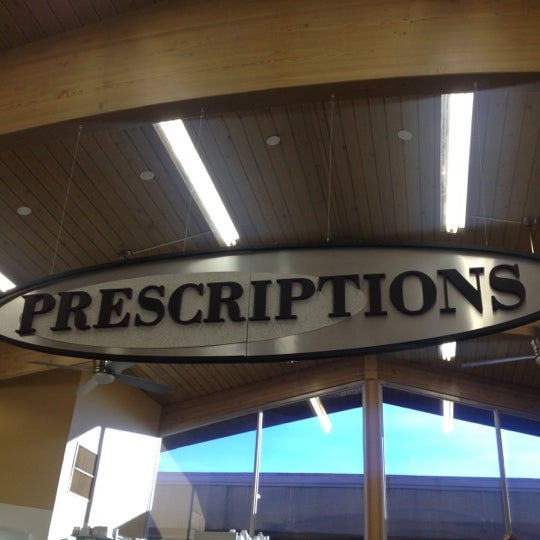
Identify the location of ceiling fan. Image resolution: width=540 pixels, height=540 pixels. (105, 375).